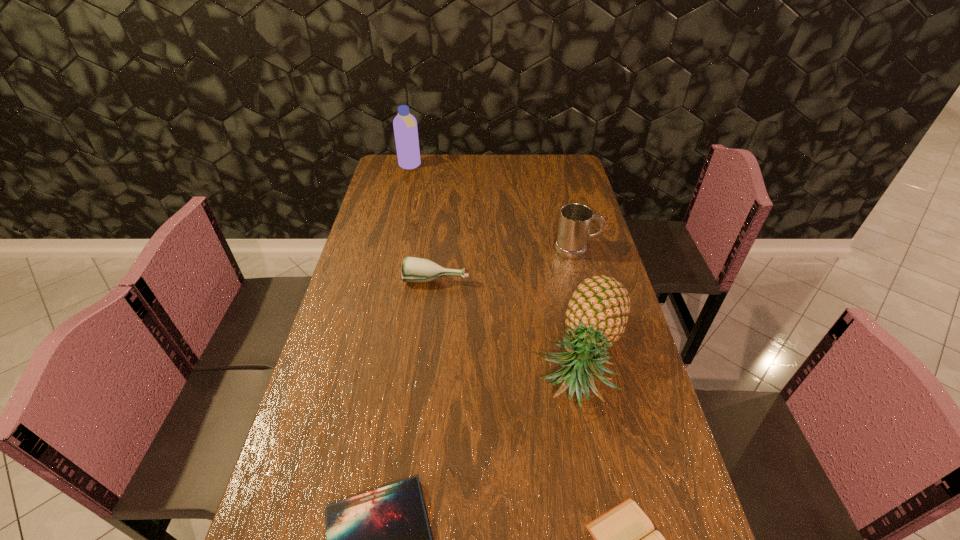
Locate an element on the screen. the farthest object is located at coordinates (405, 125).

In order to click on shampoo in this screenshot , I will do `click(405, 125)`.

At what (x,y) coordinates should I click in order to perform the action: click on the third nearest object. Please return your answer as a coordinate pair (x, y). The width and height of the screenshot is (960, 540). Looking at the image, I should click on (597, 313).

At what (x,y) coordinates should I click in order to perform the action: click on pineapple. Please return your answer as a coordinate pair (x, y). The height and width of the screenshot is (540, 960). Looking at the image, I should click on (597, 313).

I want to click on mug, so click(575, 219).

Locate an element on the screen. the second farthest object is located at coordinates (575, 219).

You are a GUI agent. You are given a task and a screenshot of the screen. Output one action in this format:
    pyautogui.click(x=<x>, y=<y>)
    Task: Click on the fourth tallest object
    The width and height of the screenshot is (960, 540).
    Given the screenshot: What is the action you would take?
    [414, 269]

The height and width of the screenshot is (540, 960). Identify the location of the third farthest object. (414, 269).

The height and width of the screenshot is (540, 960). Identify the location of vacant point located on the right of the tallest object. (502, 166).

Locate an element on the screen. This screenshot has height=540, width=960. vacant region located on the left of the pineapple is located at coordinates (469, 358).